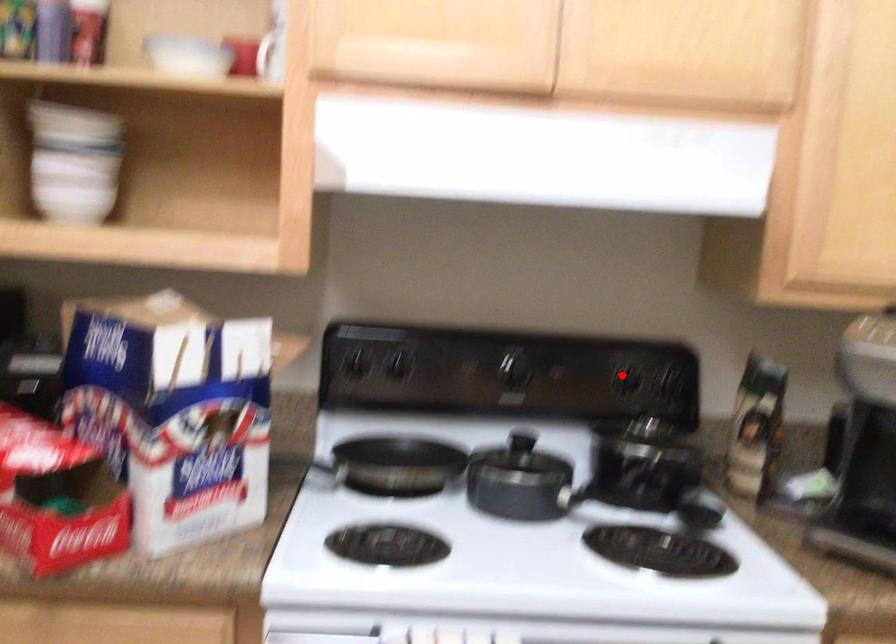
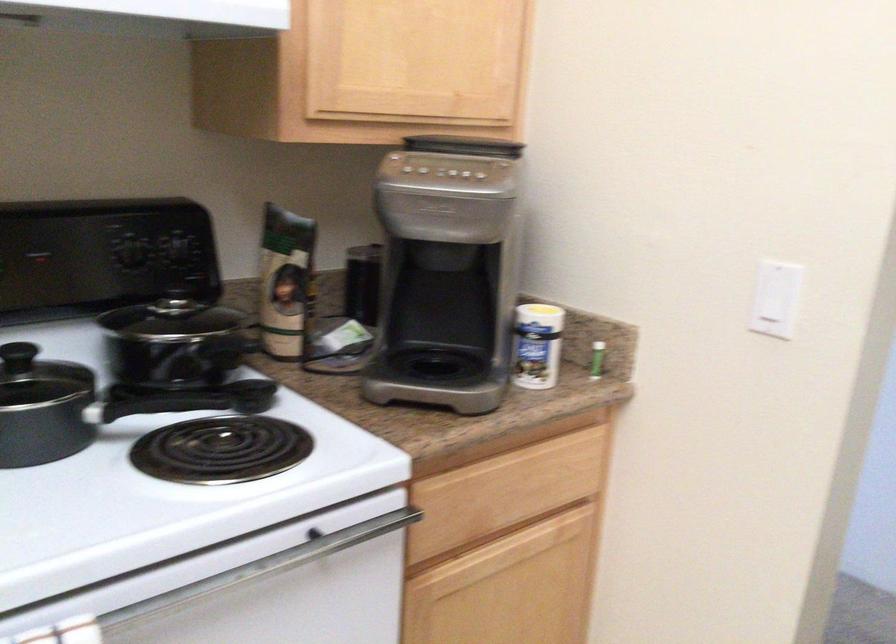
Question: I am providing you with two images of the same scene from different viewpoints. A red point is shown in image1. For the corresponding object point in image2, is it positioned nearer or farther from the camera?

Choices:
 (A) Nearer
 (B) Farther

Answer: (A)